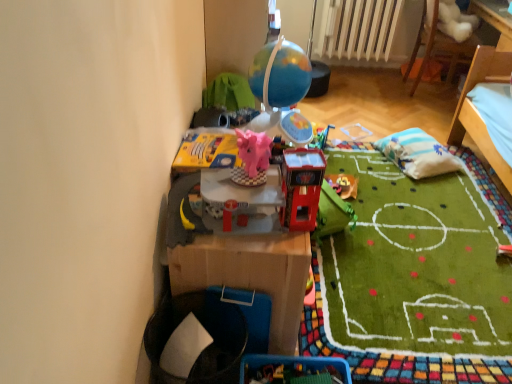
Question: Which direction should I rotate to face matte pink elephant at center, the second toy in the front-to-back sequence, — up or down?

Choices:
 (A) up
 (B) down

Answer: (A)

Question: Can you confirm if white plastic radiator at upper center is bigger than shiny plastic toy at center, the second toy positioned from the right?

Choices:
 (A) yes
 (B) no

Answer: (A)

Question: Is white plastic radiator at upper center outside shiny plastic toy at center, the second toy positioned from the right?

Choices:
 (A) no
 (B) yes

Answer: (B)

Question: Considering the relative positions of white plastic radiator at upper center and shiny plastic toy at center, the second toy positioned from the right, in the image provided, is white plastic radiator at upper center to the right of shiny plastic toy at center, the second toy positioned from the right, from the viewer's perspective?

Choices:
 (A) no
 (B) yes

Answer: (B)

Question: Can you confirm if white plastic radiator at upper center is taller than shiny plastic toy at center, arranged as the 1th toy when viewed from the front?

Choices:
 (A) yes
 (B) no

Answer: (A)

Question: Is white plastic radiator at upper center positioned in front of shiny plastic toy at center, arranged as the 1th toy when viewed from the front?

Choices:
 (A) no
 (B) yes

Answer: (A)

Question: Is white plastic radiator at upper center wider than shiny plastic toy at center, arranged as the 1th toy when viewed from the front?

Choices:
 (A) no
 (B) yes

Answer: (B)

Question: Considering the relative sizes of shiny plastic toy at center, arranged as the 1th toy when viewed from the front, and white plastic radiator at upper center in the image provided, is shiny plastic toy at center, arranged as the 1th toy when viewed from the front, smaller than white plastic radiator at upper center?

Choices:
 (A) no
 (B) yes

Answer: (B)

Question: Is shiny plastic toy at center, the 3th toy positioned from the back, positioned far away from white plastic radiator at upper center?

Choices:
 (A) no
 (B) yes

Answer: (B)

Question: Does shiny plastic toy at center, arranged as the 1th toy when viewed from the front, turn towards white plastic radiator at upper center?

Choices:
 (A) no
 (B) yes

Answer: (A)

Question: Can you confirm if shiny plastic toy at center, the 3th toy positioned from the back, is shorter than white plastic radiator at upper center?

Choices:
 (A) yes
 (B) no

Answer: (A)

Question: From a real-world perspective, is shiny plastic toy at center, the second toy positioned from the right, positioned over white plastic radiator at upper center based on gravity?

Choices:
 (A) no
 (B) yes

Answer: (B)

Question: Does shiny plastic toy at center, the second toy positioned from the right, have a larger size compared to white plastic radiator at upper center?

Choices:
 (A) yes
 (B) no

Answer: (B)

Question: Is shiny plastic toy at center, the third toy when ordered from left to right, touching striped fabric pillow at center right?

Choices:
 (A) yes
 (B) no

Answer: (B)